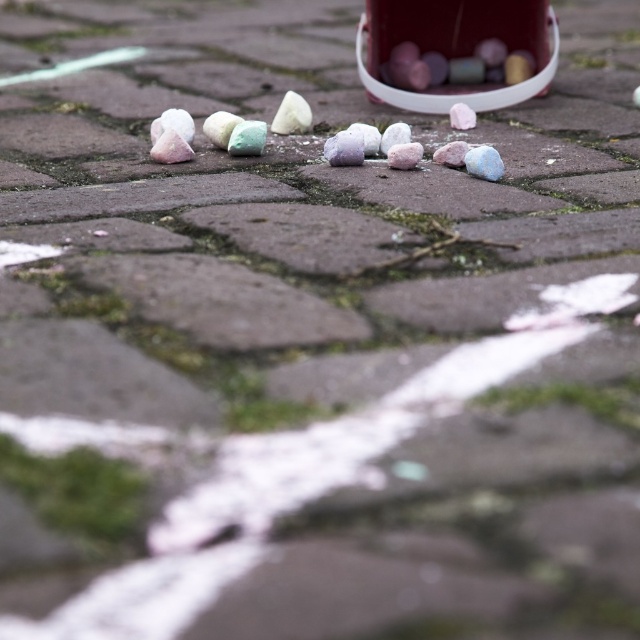
You are a child holding a ruler and want to measure the distance between the glossy plastic cotton candy at upper right and the white matte rock at center. Can you accurately measure this distance with your ruler?

The distance between the glossy plastic cotton candy at upper right and the white matte rock at center is 20.57 inches, so yes, you can accurately measure this distance with your ruler since it is a standard measurement.

You are standing on the cobblestone pavement and see the white matte rock at center and the white matte cotton candy at center. Which object is closer to you?

The white matte rock at center is closer to you because it is in front of the white matte cotton candy at center.

You are a child trying to reach for the cotton candies in the image. Which one can you grab first without moving your position? The glossy plastic cotton candy at upper right or the white matte cotton candy at center?

The glossy plastic cotton candy at upper right is closer to you, so you can grab it first without moving your position.